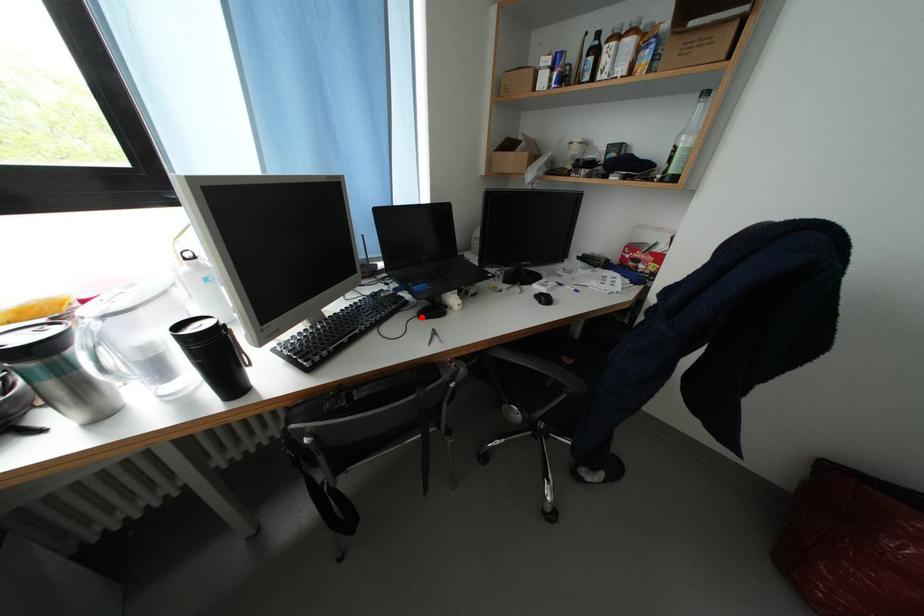
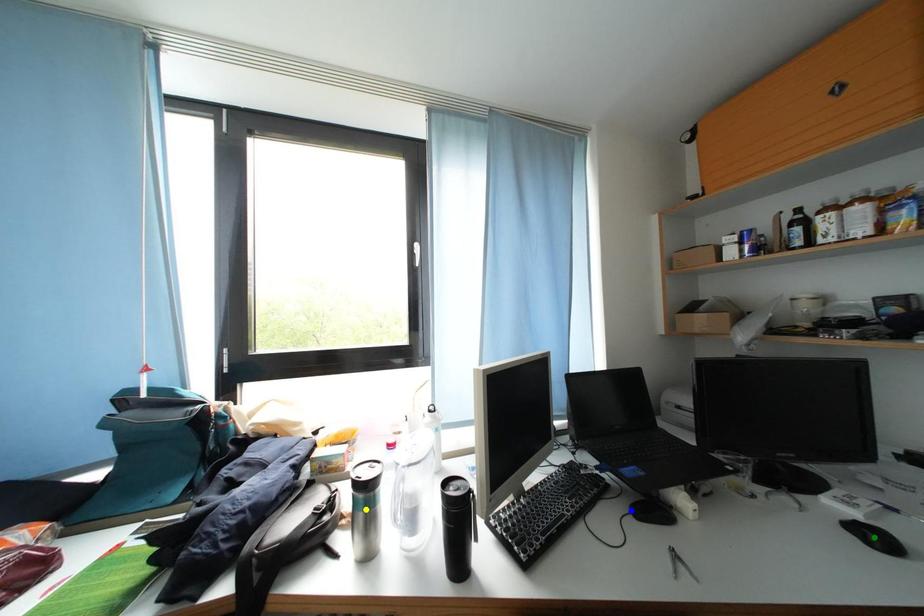
Question: I am providing you with two images of the same scene from different viewpoints. A red point is marked on the first image. You are given multiple points on the second image. Can you choose the point in image 2 that corresponds to the point in image 1?

Choices:
 (A) blue point
 (B) yellow point
 (C) green point

Answer: (A)